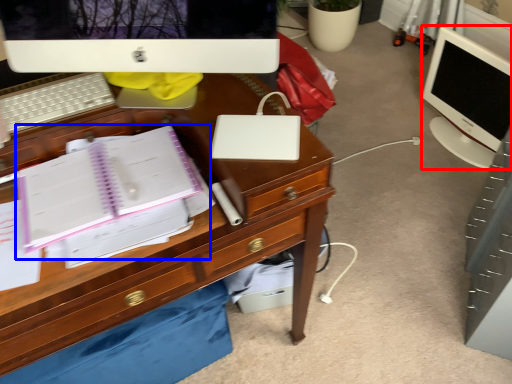
Question: Among these objects, which one is nearest to the camera, computer monitor (highlighted by a red box) or notebook (highlighted by a blue box)?

Choices:
 (A) computer monitor
 (B) notebook

Answer: (B)